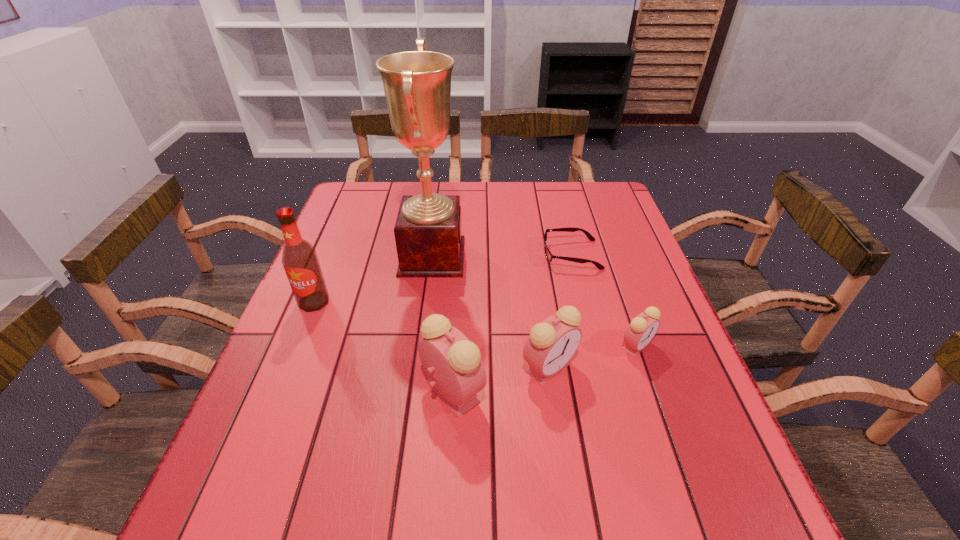
Locate an element on the screen. This screenshot has width=960, height=540. vacant point that satisfies the following two spatial constraints: 1. on the face of the fourth tallest object; 2. on the face of the leftmost alarm clock is located at coordinates (553, 392).

This screenshot has width=960, height=540. I want to click on vacant area that satisfies the following two spatial constraints: 1. on the face of the second shortest object; 2. on the face of the leftmost alarm clock, so click(x=652, y=392).